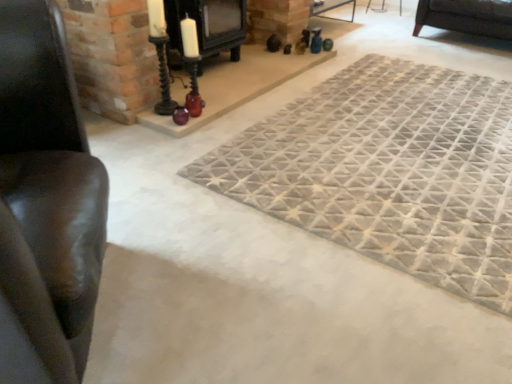
Question: Does point (404, 137) appear closer or farther from the camera than point (73, 140)?

Choices:
 (A) farther
 (B) closer

Answer: (A)

Question: Is textured gray mat at center bigger or smaller than leather couch at left?

Choices:
 (A) small
 (B) big

Answer: (A)

Question: Estimate the real-world distances between objects in this image. Which object is farther from the leather couch at left?

Choices:
 (A) black matte fireplace at upper center
 (B) textured gray mat at center

Answer: (A)

Question: Estimate the real-world distances between objects in this image. Which object is closer to the leather couch at left?

Choices:
 (A) textured gray mat at center
 (B) black matte fireplace at upper center

Answer: (A)